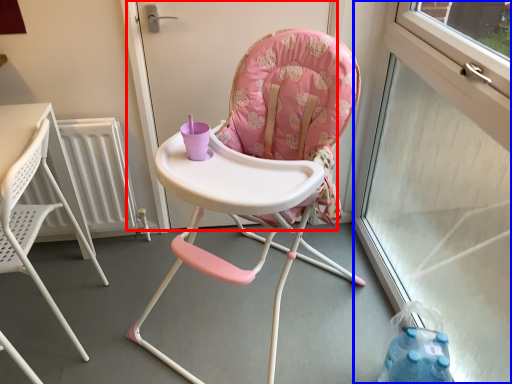
Question: Which object appears farthest to the camera in this image, screen door (highlighted by a red box) or window screen (highlighted by a blue box)?

Choices:
 (A) screen door
 (B) window screen

Answer: (A)